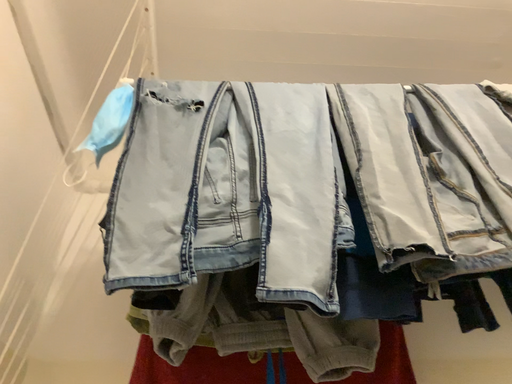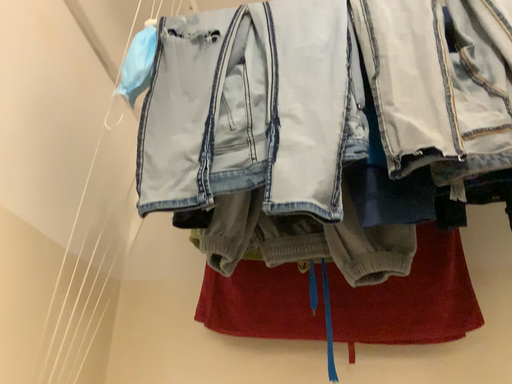
Question: Which way did the camera rotate in the video?

Choices:
 (A) rotated downward
 (B) rotated upward

Answer: (A)